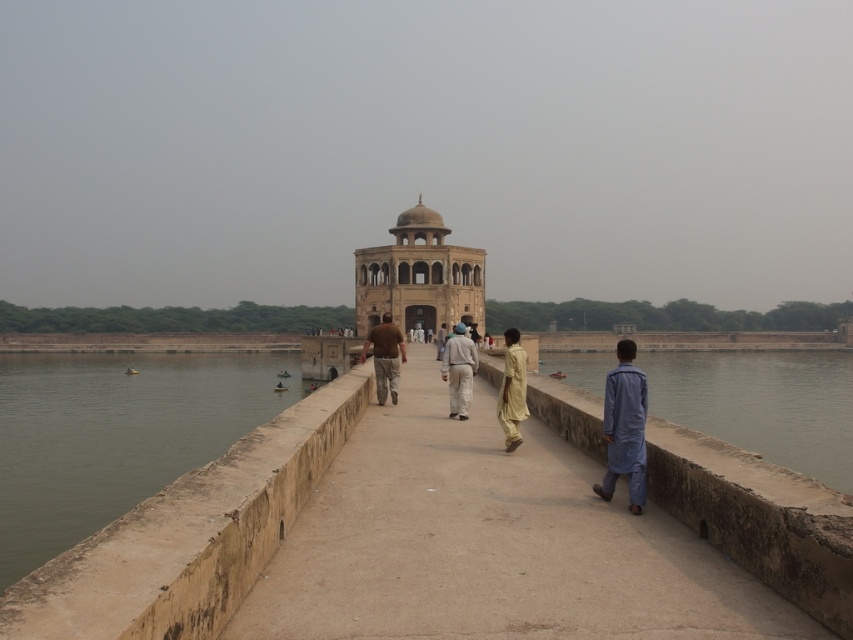
Which is more to the left, green concrete river at lower right or light brown fabric shirt at center?

From the viewer's perspective, light brown fabric shirt at center appears more on the left side.

Measure the distance from green concrete river at lower right to light brown fabric shirt at center.

A distance of 47.69 meters exists between green concrete river at lower right and light brown fabric shirt at center.

Locate an element on the screen. green concrete river at lower right is located at coordinates (762, 404).

This screenshot has height=640, width=853. What are the coordinates of `green concrete river at lower right` in the screenshot? It's located at (762, 404).

Is beige stone palace at center shorter than light beige cotton pants at center?

No.

Is beige stone palace at center thinner than light beige cotton pants at center?

No.

Between point (462, 259) and point (468, 372), which one is positioned in front?

Point (468, 372)

The image size is (853, 640). I want to click on beige stone palace at center, so click(418, 276).

Can you confirm if blue cotton shirt at right is shorter than light brown fabric shirt at center?

Incorrect, blue cotton shirt at right's height does not fall short of light brown fabric shirt at center's.

Who is more forward, (627, 435) or (437, 355)?

Point (627, 435) is more forward.

I want to click on blue cotton shirt at right, so click(x=624, y=428).